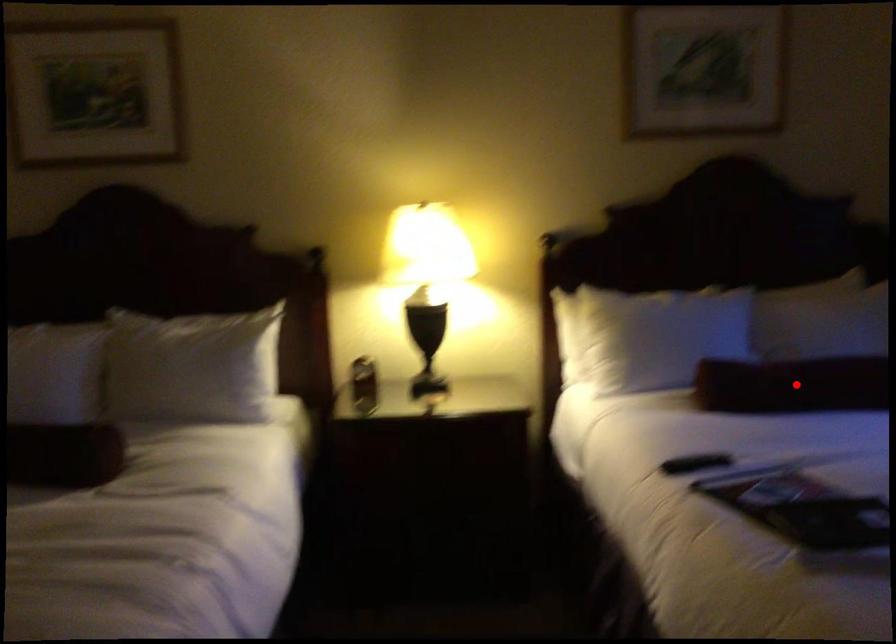
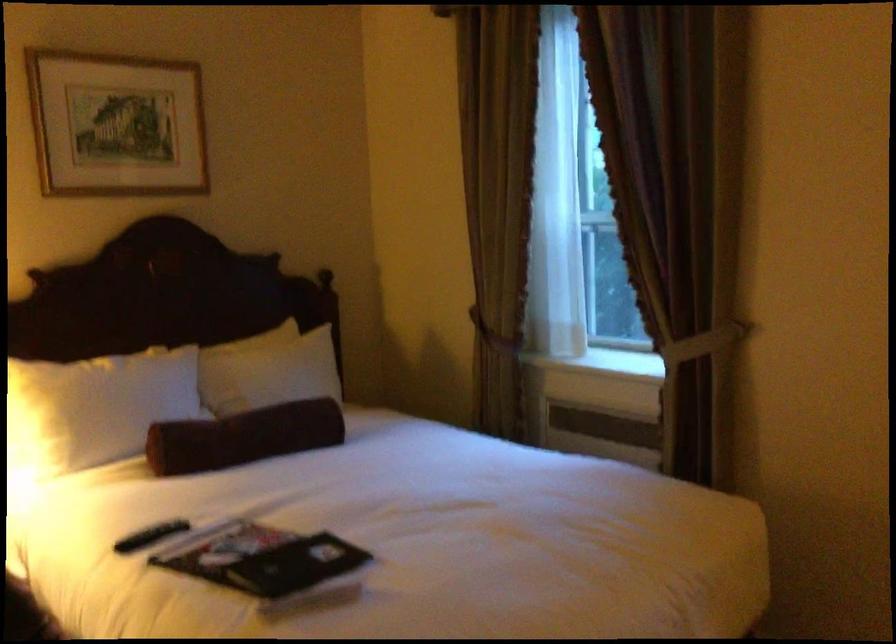
Locate, in the second image, the point that corresponds to the highlighted location in the first image.

(243, 437)